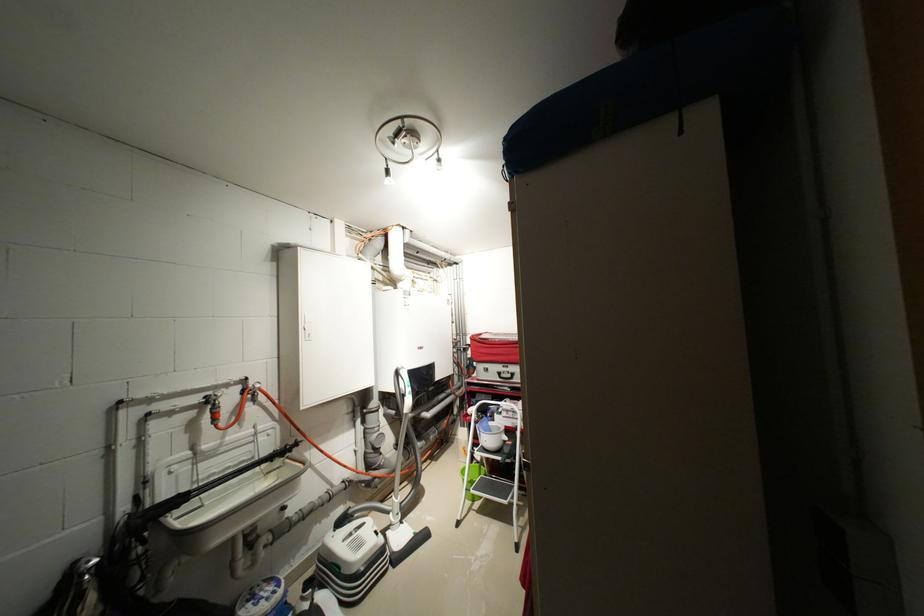
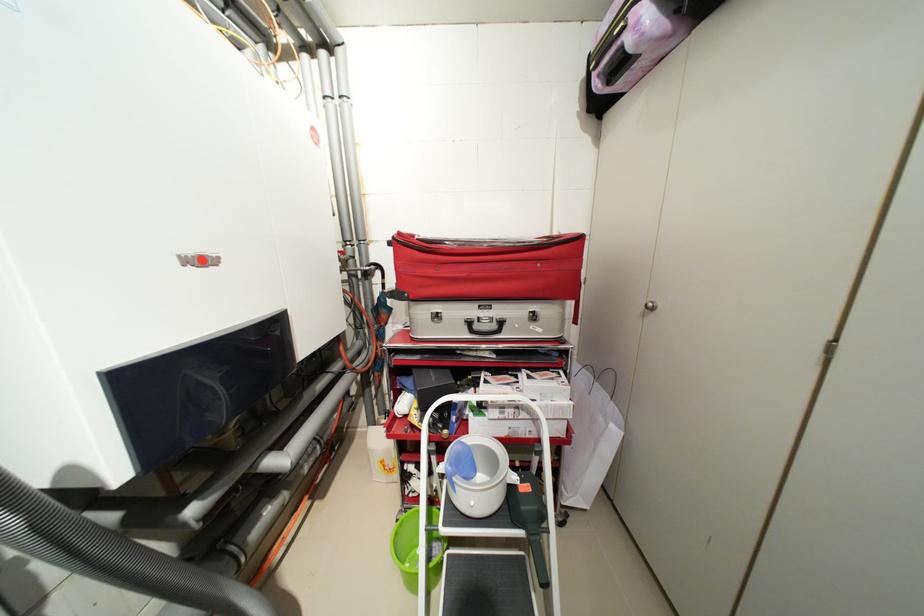
Where in the second image is the point corresponding to pixel 517 377 from the first image?

(502, 326)